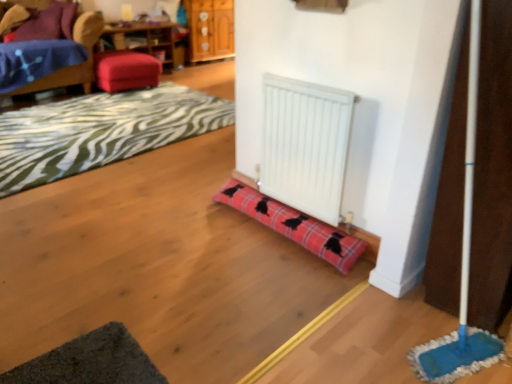
Question: Considering the relative sizes of dark gray textured yoga mat at lower left and wooden dresser at upper center in the image provided, is dark gray textured yoga mat at lower left shorter than wooden dresser at upper center?

Choices:
 (A) no
 (B) yes

Answer: (B)

Question: Considering the relative positions of dark gray textured yoga mat at lower left and wooden dresser at upper center in the image provided, is dark gray textured yoga mat at lower left to the left of wooden dresser at upper center from the viewer's perspective?

Choices:
 (A) no
 (B) yes

Answer: (A)

Question: Does dark gray textured yoga mat at lower left have a lesser width compared to wooden dresser at upper center?

Choices:
 (A) no
 (B) yes

Answer: (B)

Question: Is dark gray textured yoga mat at lower left smaller than wooden dresser at upper center?

Choices:
 (A) no
 (B) yes

Answer: (B)

Question: Is dark gray textured yoga mat at lower left facing towards wooden dresser at upper center?

Choices:
 (A) no
 (B) yes

Answer: (A)

Question: Considering the positions of plaid fabric mat at lower left and red plaid doorstop at center in the image, is plaid fabric mat at lower left bigger or smaller than red plaid doorstop at center?

Choices:
 (A) big
 (B) small

Answer: (A)

Question: Is plaid fabric mat at lower left to the left or to the right of red plaid doorstop at center in the image?

Choices:
 (A) right
 (B) left

Answer: (B)

Question: Is plaid fabric mat at lower left in front of or behind red plaid doorstop at center in the image?

Choices:
 (A) front
 (B) behind

Answer: (B)

Question: Is point (89, 114) positioned closer to the camera than point (309, 226)?

Choices:
 (A) farther
 (B) closer

Answer: (A)

Question: From their relative heights in the image, would you say red plaid doorstop at center is taller or shorter than wooden table at upper left?

Choices:
 (A) tall
 (B) short

Answer: (B)

Question: In terms of width, does red plaid doorstop at center look wider or thinner when compared to wooden table at upper left?

Choices:
 (A) wide
 (B) thin

Answer: (B)

Question: Is red plaid doorstop at center to the left or to the right of wooden table at upper left in the image?

Choices:
 (A) left
 (B) right

Answer: (B)

Question: Is point (243, 183) closer or farther from the camera than point (138, 51)?

Choices:
 (A) farther
 (B) closer

Answer: (B)

Question: Is white matte radiator at center situated inside wooden dresser at upper center or outside?

Choices:
 (A) outside
 (B) inside

Answer: (A)

Question: From a real-world perspective, is white matte radiator at center physically located above or below wooden dresser at upper center?

Choices:
 (A) below
 (B) above

Answer: (B)